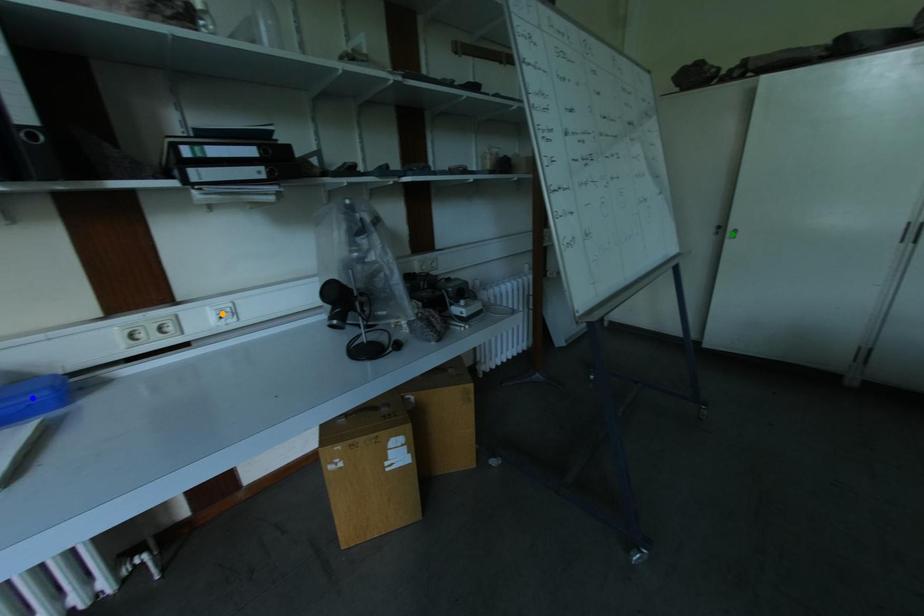
Order these from nearest to farthest:
A) blue point
B) orange point
C) green point

blue point
orange point
green point